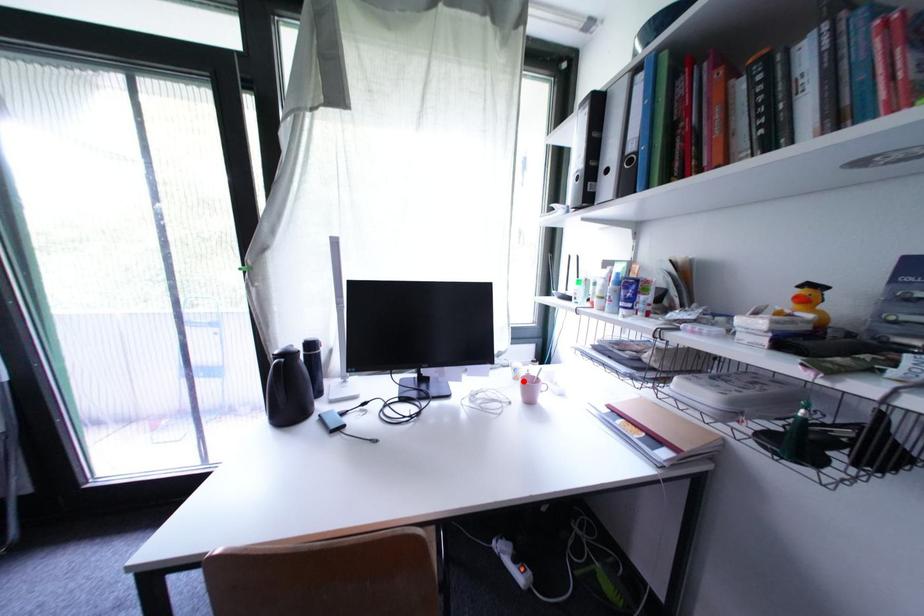
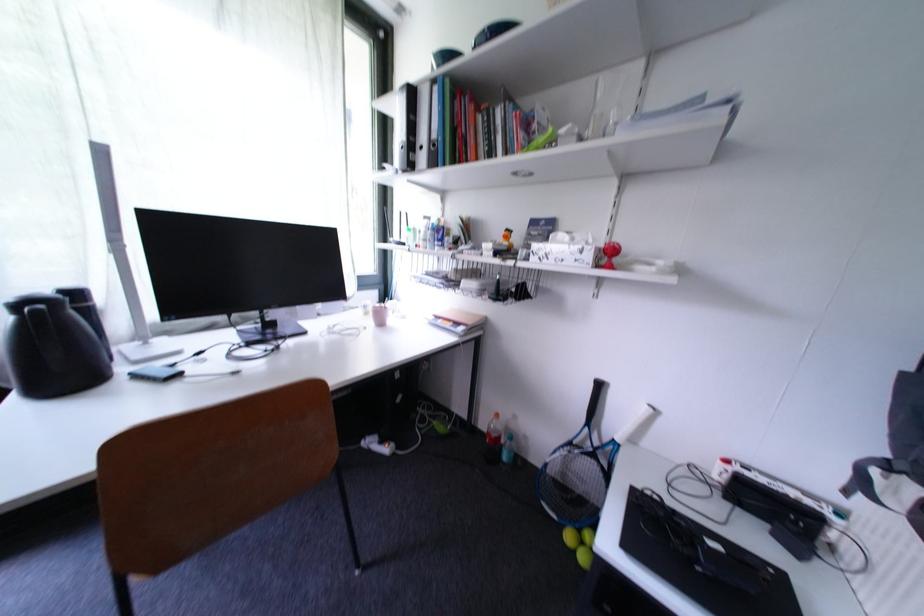
Locate, in the second image, the point that corresponds to the highlighted location in the first image.

(373, 315)